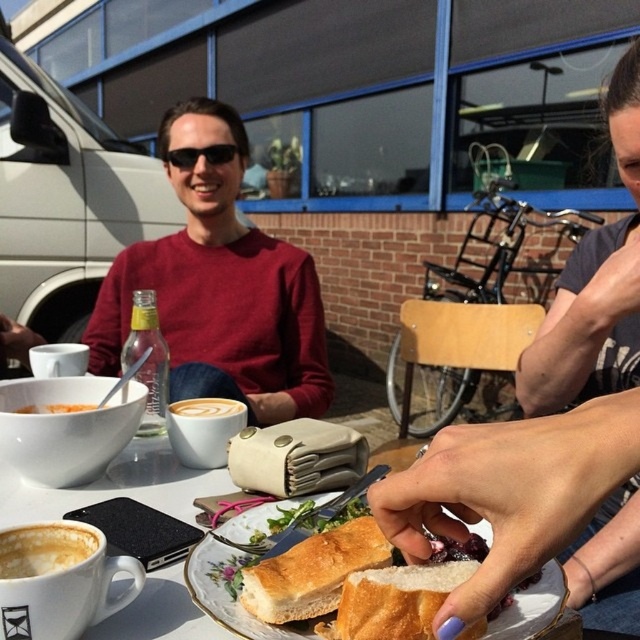
Question: Which object is positioned closest to the black plastic sunglasses at center?

Choices:
 (A) latte art foam at center
 (B) white ceramic table at center
 (C) matte white bowl at center-left

Answer: (A)

Question: Which point is closer to the camera?

Choices:
 (A) (380, 548)
 (B) (188, 417)
 (C) (80, 404)
 (D) (54, 536)

Answer: (D)

Question: Considering the relative positions of golden bread at center and golden bread sandwich at center in the image provided, where is golden bread at center located with respect to golden bread sandwich at center?

Choices:
 (A) left
 (B) right

Answer: (B)

Question: Where is matte white soup at lower left located in relation to black plastic sunglasses at center in the image?

Choices:
 (A) below
 (B) above

Answer: (A)

Question: Is the position of golden bread at center less distant than that of golden bread sandwich at center?

Choices:
 (A) yes
 (B) no

Answer: (A)

Question: Estimate the real-world distances between objects in this image. Which object is farther from the matte white soup at lower left?

Choices:
 (A) black plastic sunglasses at center
 (B) latte art foam at center
 (C) matte red sweater at center
 (D) golden bread at center

Answer: (A)